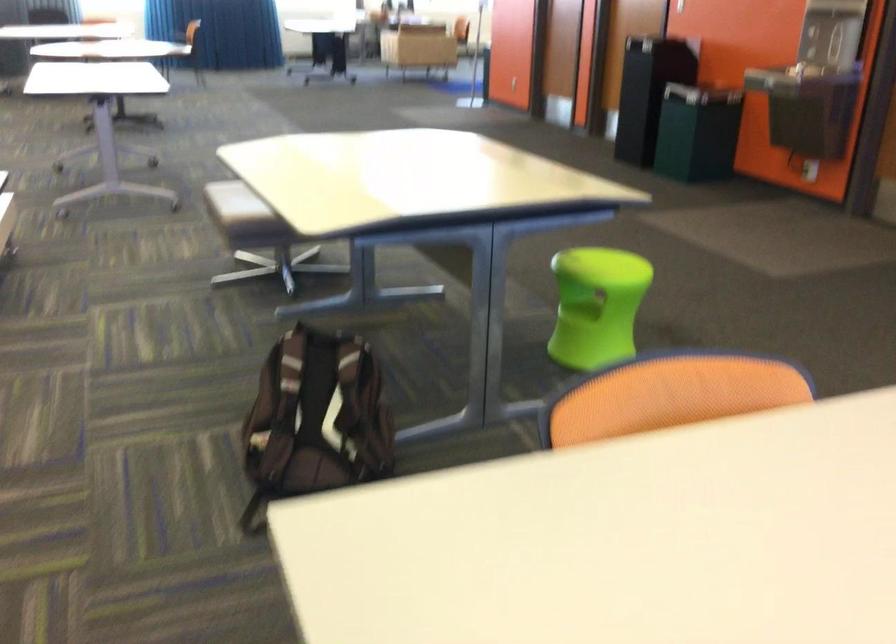
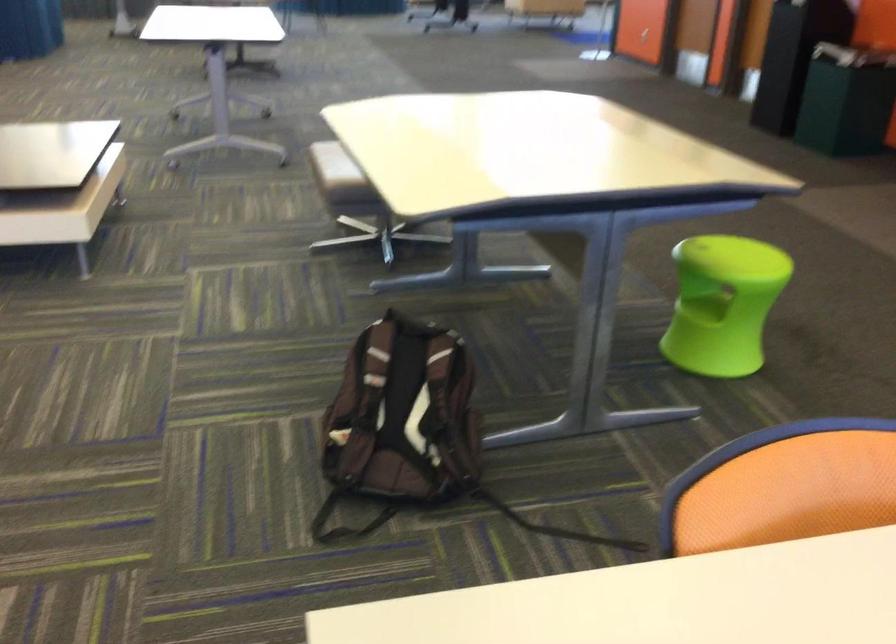
Find the pixel in the second image that matches point (685, 469) in the first image.

(832, 585)